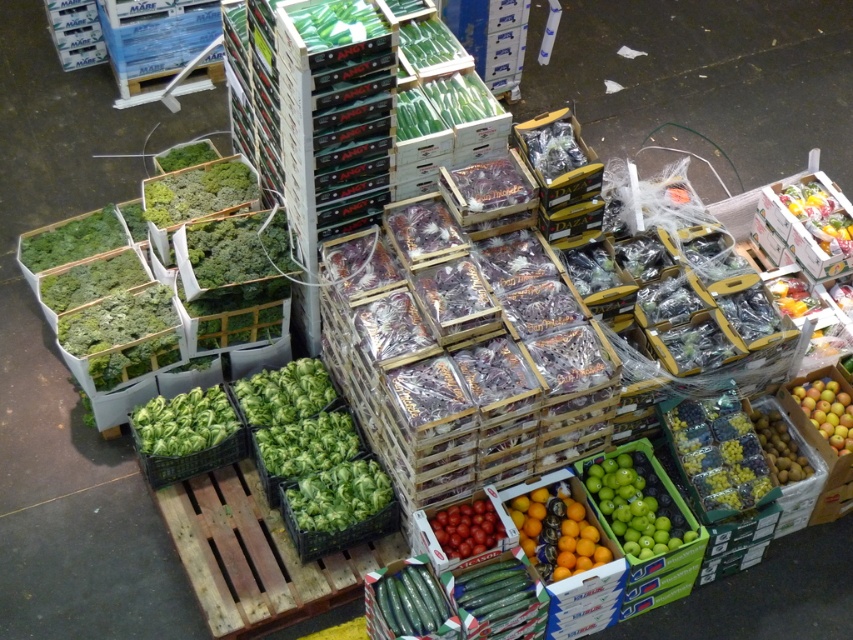
Is green leafy lettuce at center to the left of green matte cucumber at center from the viewer's perspective?

Correct, you'll find green leafy lettuce at center to the left of green matte cucumber at center.

Can you confirm if green leafy lettuce at center is thinner than green matte cucumber at center?

Incorrect, green leafy lettuce at center's width is not less than green matte cucumber at center's.

I want to click on green leafy lettuce at center, so click(x=338, y=496).

Can you confirm if green leafy at center is taller than shiny red tomatoes at center?

Yes, green leafy at center is taller than shiny red tomatoes at center.

Is green leafy at center to the left of shiny red tomatoes at center from the viewer's perspective?

Indeed, green leafy at center is positioned on the left side of shiny red tomatoes at center.

Find the location of a particular element. This screenshot has height=640, width=853. green leafy at center is located at coordinates (183, 422).

Find the location of a particular element. green leafy at center is located at coordinates (183, 422).

Between glossy orange at center and green leafy lettuce at center, which one has more height?

Standing taller between the two is glossy orange at center.

Between glossy orange at center and green leafy lettuce at center, which one appears on the right side from the viewer's perspective?

Positioned to the right is glossy orange at center.

This screenshot has width=853, height=640. Describe the element at coordinates (556, 532) in the screenshot. I see `glossy orange at center` at that location.

Locate an element on the screen. glossy orange at center is located at coordinates (556, 532).